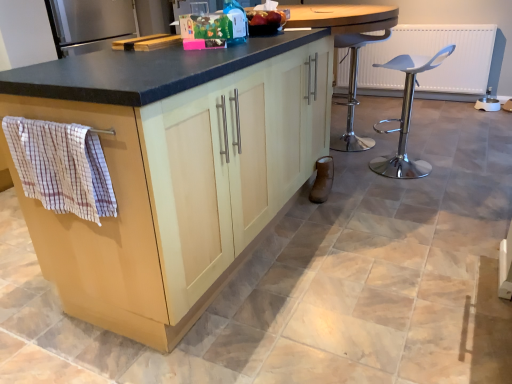
Describe the element at coordinates (61, 167) in the screenshot. I see `checkered fabric hand towel at left` at that location.

Describe the element at coordinates (175, 172) in the screenshot. I see `matte wood cabinet at left` at that location.

Find the location of a particular element. checkered fabric hand towel at left is located at coordinates (61, 167).

Does checkered fabric hand towel at left have a lesser height compared to white plastic stool at right?

Indeed, checkered fabric hand towel at left has a lesser height compared to white plastic stool at right.

Does checkered fabric hand towel at left turn towards white plastic stool at right?

No, checkered fabric hand towel at left is not aimed at white plastic stool at right.

Looking at this image, can you confirm if checkered fabric hand towel at left is thinner than white plastic stool at right?

No, checkered fabric hand towel at left is not thinner than white plastic stool at right.

From the image's perspective, would you say checkered fabric hand towel at left is positioned over matte wood cabinet at left?

No.

Which is correct: checkered fabric hand towel at left is inside matte wood cabinet at left, or outside of it?

checkered fabric hand towel at left lies outside matte wood cabinet at left.

Looking at this image, from a real-world perspective, is checkered fabric hand towel at left beneath matte wood cabinet at left?

Incorrect, from a real-world perspective, checkered fabric hand towel at left is higher than matte wood cabinet at left.

Is matte wood cabinet at left inside white plastic stool at right?

Definitely not — matte wood cabinet at left is not inside white plastic stool at right.

Is white plastic stool at right taller than matte wood cabinet at left?

In fact, white plastic stool at right may be shorter than matte wood cabinet at left.

Who is more distant, white plastic stool at right or matte wood cabinet at left?

white plastic stool at right is more distant.

From a real-world perspective, which object stands above the other?

checkered fabric hand towel at left is physically above.

Would you say matte wood cabinet at left is a long distance from checkered fabric hand towel at left?

They are positioned close to each other.

The width and height of the screenshot is (512, 384). In order to click on hand towel positioned vertically above the matte wood cabinet at left (from a real-world perspective) in this screenshot , I will do `click(61, 167)`.

Is matte wood cabinet at left spatially inside checkered fabric hand towel at left, or outside of it?

matte wood cabinet at left cannot be found inside checkered fabric hand towel at left.

This screenshot has height=384, width=512. Find the location of `hand towel located on the left of white plastic stool at right`. hand towel located on the left of white plastic stool at right is located at coordinates (61, 167).

Considering the relative sizes of white plastic stool at right and checkered fabric hand towel at left in the image provided, is white plastic stool at right wider than checkered fabric hand towel at left?

No.

Can we say white plastic stool at right lies outside checkered fabric hand towel at left?

Yes, white plastic stool at right is outside of checkered fabric hand towel at left.

Is the surface of white plastic stool at right in direct contact with checkered fabric hand towel at left?

They are not placed beside each other.

This screenshot has width=512, height=384. In order to click on chair on the right of matte wood cabinet at left in this screenshot , I will do `click(406, 117)`.

Considering the positions of points (230, 171) and (419, 177), is point (230, 171) farther from camera compared to point (419, 177)?

No.

Can you see matte wood cabinet at left touching white plastic stool at right?

No, matte wood cabinet at left is not in contact with white plastic stool at right.

From a real-world perspective, is matte wood cabinet at left above or below white plastic stool at right?

In terms of real-world spatial position, matte wood cabinet at left is above white plastic stool at right.

Identify the location of chair located behind the checkered fabric hand towel at left. (406, 117).

Where is `hand towel to the left of matte wood cabinet at left`? The width and height of the screenshot is (512, 384). hand towel to the left of matte wood cabinet at left is located at coordinates (61, 167).

From the image, which object appears to be farther from checkered fabric hand towel at left, white plastic stool at right or matte wood cabinet at left?

Among the two, white plastic stool at right is located further to checkered fabric hand towel at left.

From the image, which object appears to be nearer to white plastic stool at right, matte wood cabinet at left or checkered fabric hand towel at left?

matte wood cabinet at left is positioned closer to the anchor white plastic stool at right.

Which object lies further to the anchor point matte wood cabinet at left, checkered fabric hand towel at left or white plastic stool at right?

Among the two, white plastic stool at right is located further to matte wood cabinet at left.

From the image, which object appears to be nearer to matte wood cabinet at left, white plastic stool at right or checkered fabric hand towel at left?

checkered fabric hand towel at left lies closer to matte wood cabinet at left than the other object.

From the image, which object appears to be nearer to checkered fabric hand towel at left, matte wood cabinet at left or white plastic stool at right?

Among the two, matte wood cabinet at left is located nearer to checkered fabric hand towel at left.

From the picture: Looking at the image, which one is located further to white plastic stool at right, checkered fabric hand towel at left or matte wood cabinet at left?

The object further to white plastic stool at right is checkered fabric hand towel at left.

I want to click on cabinetry between checkered fabric hand towel at left and white plastic stool at right, so click(x=175, y=172).